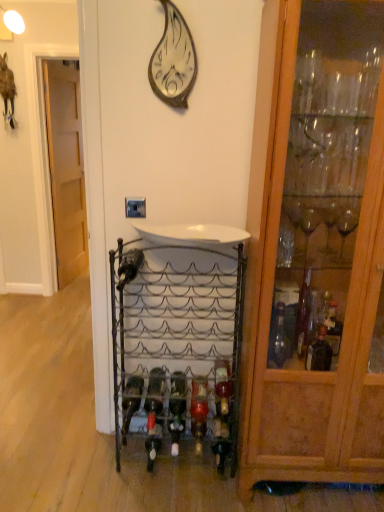
You are a GUI agent. You are given a task and a screenshot of the screen. Output one action in this format:
    pyautogui.click(x=<x>, y=<y>)
    Task: Click on the free spot to the left of metallic wine rack at center
    
    Given the screenshot: What is the action you would take?
    tap(102, 482)